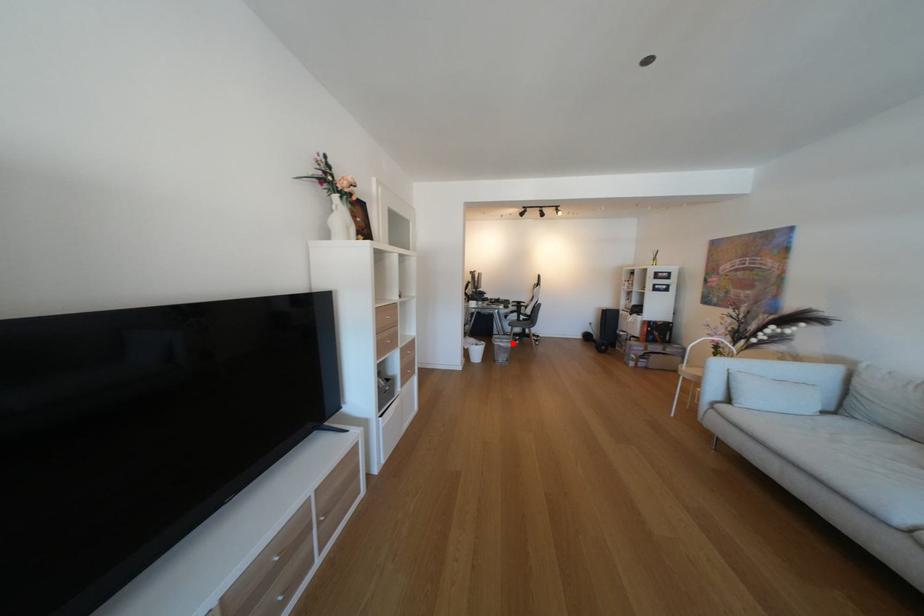
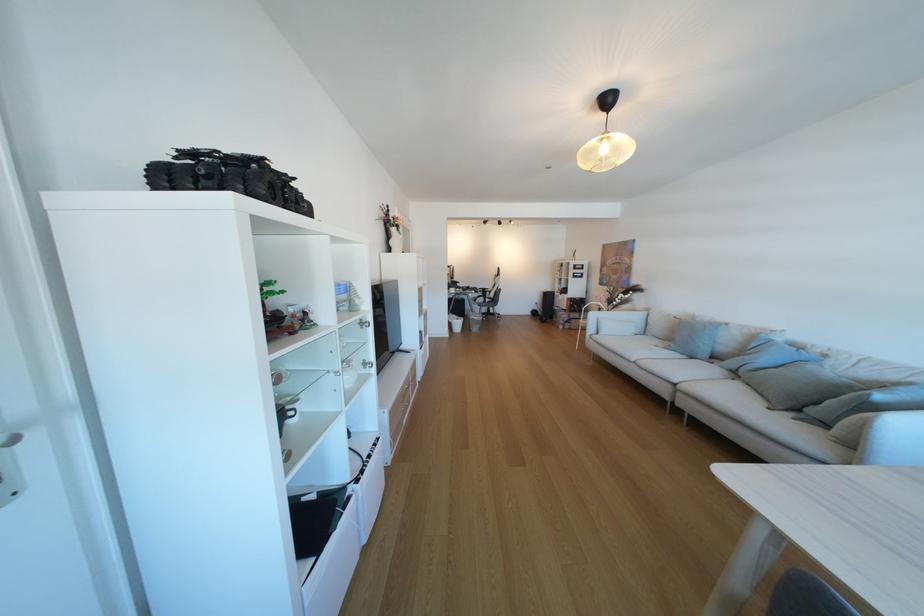
Locate, in the second image, the point that corresponds to the highlighted location in the first image.

(485, 317)